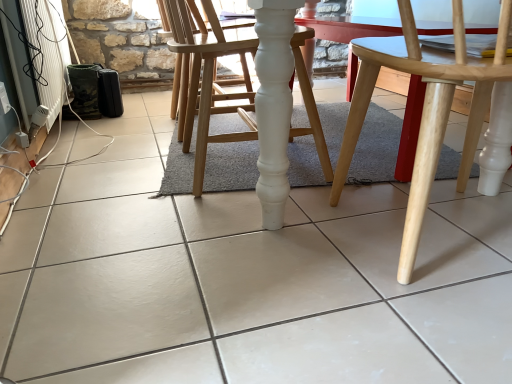
Question: From a real-world perspective, is natural wood chair at center, which is the 1th chair from right to left, positioned above or below white plastic radiator at lower left?

Choices:
 (A) below
 (B) above

Answer: (A)

Question: Is natural wood chair at center, which is the 1th chair from right to left, bigger or smaller than white plastic radiator at lower left?

Choices:
 (A) big
 (B) small

Answer: (A)

Question: Estimate the real-world distances between objects in this image. Which object is closer to the white plastic radiator at lower left?

Choices:
 (A) natural wood chair at center, which is the 1th chair from right to left
 (B) white wood chair at center, which ranks as the 1th chair in left-to-right order

Answer: (B)

Question: Based on their relative distances, which object is nearer to the white wood chair at center, which ranks as the 1th chair in left-to-right order?

Choices:
 (A) white plastic radiator at lower left
 (B) natural wood chair at center, which is the 1th chair from right to left

Answer: (B)